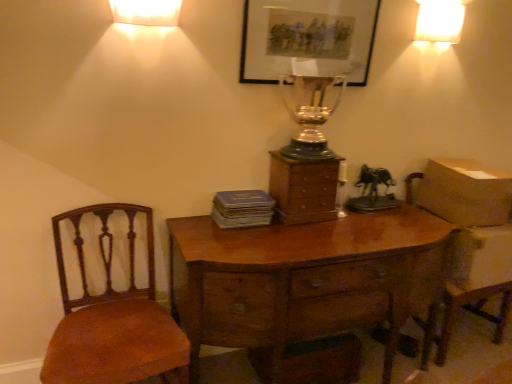
Where is `free space above matte gray book at center (from a real-world perspective)`? free space above matte gray book at center (from a real-world perspective) is located at coordinates (239, 196).